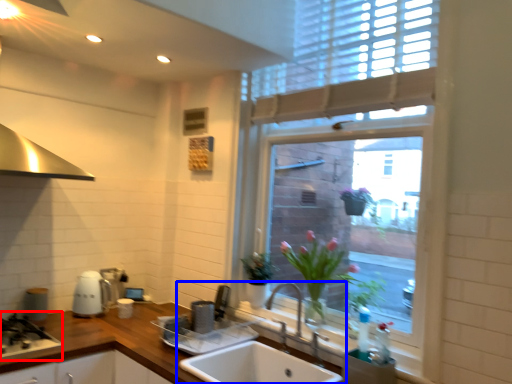
Question: Which object appears farthest to the camera in this image, gas stove (highlighted by a red box) or sink (highlighted by a blue box)?

Choices:
 (A) gas stove
 (B) sink

Answer: (A)